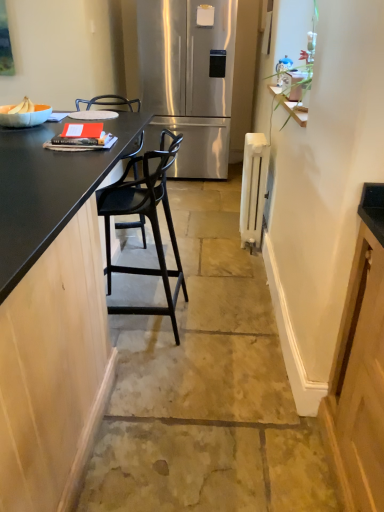
What are the coordinates of `free space in front of black matte bar stool at center` in the screenshot? It's located at (160, 387).